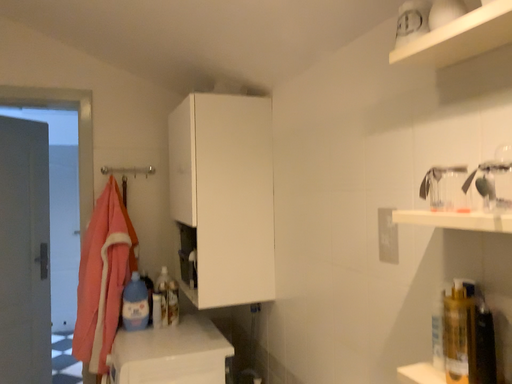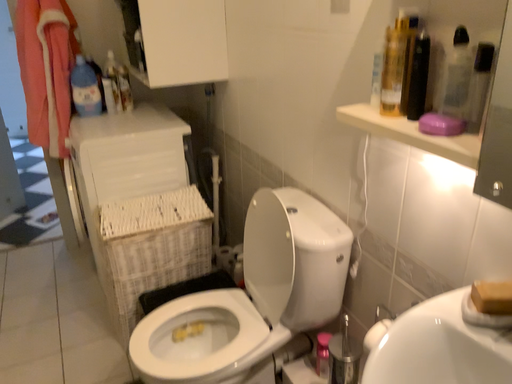
Question: How did the camera likely rotate when shooting the video?

Choices:
 (A) rotated downward
 (B) rotated upward

Answer: (A)